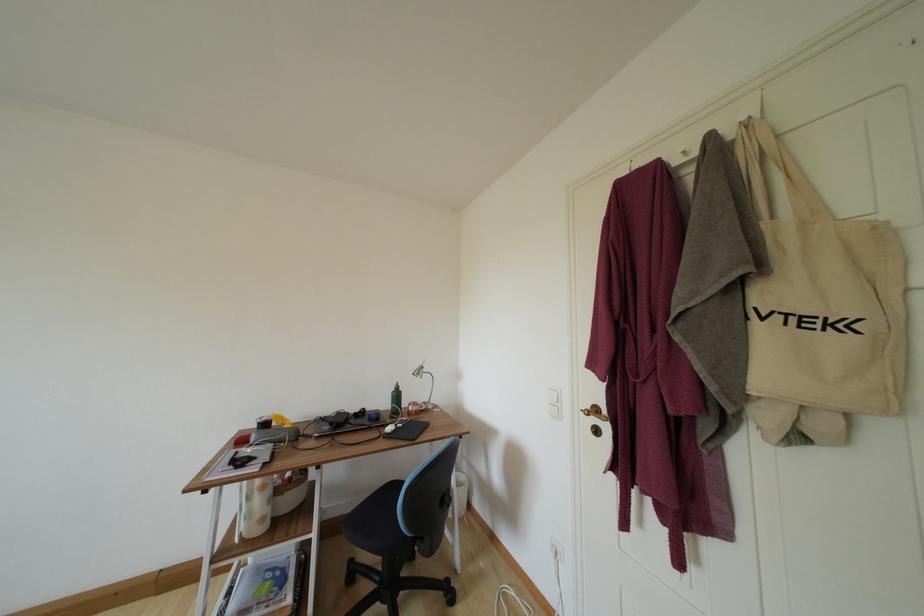
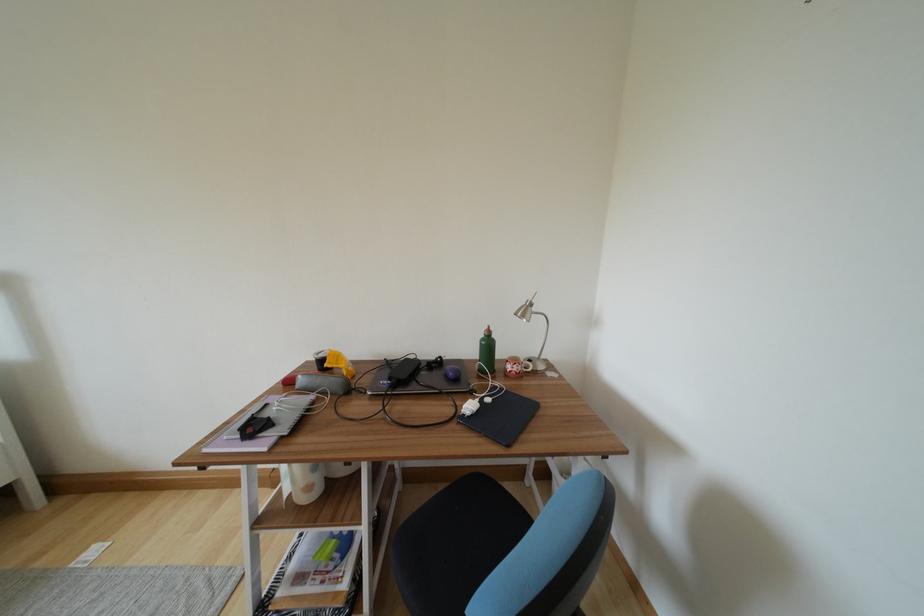
Question: What movement of the cameraman would produce the second image?

Choices:
 (A) Left
 (B) Right
 (C) Forward
 (D) Backward

Answer: (C)